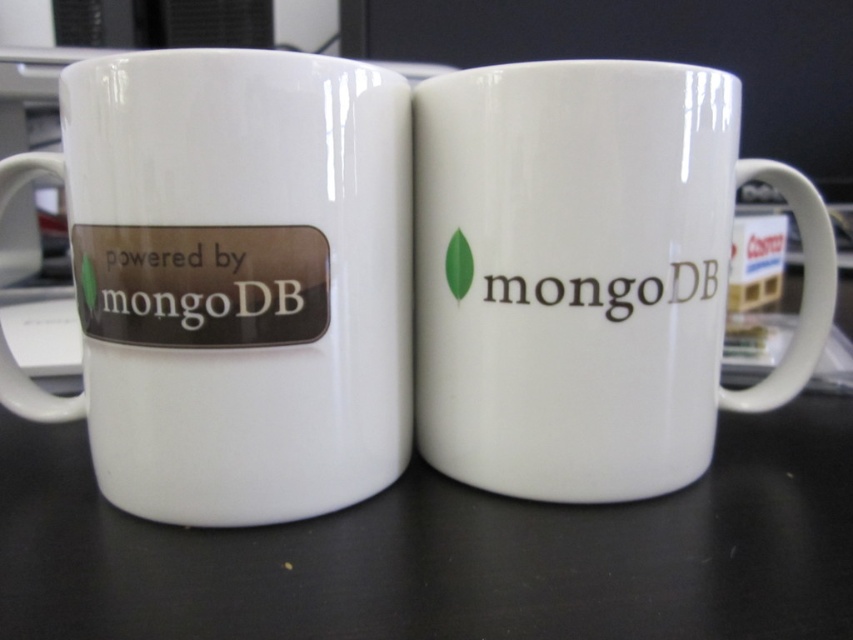
In the scene shown: Is white glossy mug at left bigger than white glossy mug at center?

No, white glossy mug at left is not bigger than white glossy mug at center.

What do you see at coordinates (241, 280) in the screenshot? I see `white glossy mug at left` at bounding box center [241, 280].

The image size is (853, 640). Identify the location of white glossy mug at left. (241, 280).

Does white ceramic mug at center have a lesser height compared to white glossy mug at center?

In fact, white ceramic mug at center may be taller than white glossy mug at center.

Does white ceramic mug at center appear on the left side of white glossy mug at center?

In fact, white ceramic mug at center is to the right of white glossy mug at center.

Between point (519, 285) and point (781, 570), which one is positioned behind?

The point (519, 285) is behind.

In order to click on white ceramic mug at center in this screenshot , I will do `click(587, 275)`.

Does white ceramic mug at center lie behind white glossy mug at left?

Yes, it is behind white glossy mug at left.

Between white ceramic mug at center and white glossy mug at left, which one appears on the left side from the viewer's perspective?

white glossy mug at left

Identify the location of white ceramic mug at center. (587, 275).